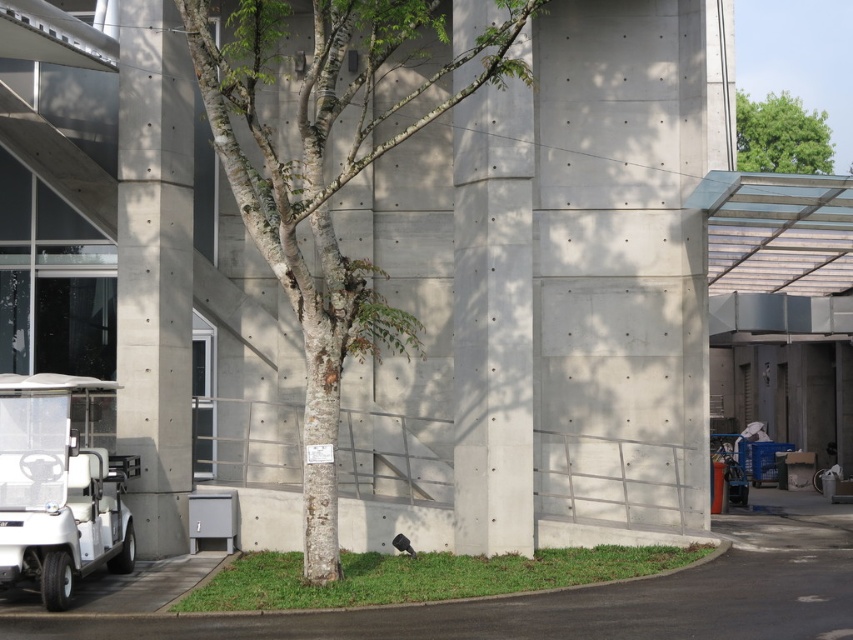
You are a city planner assessing the urban space in front of the building. You need to install a new streetlight that must be at least 2 meters taller than the tallest object in the area to ensure proper lighting. Based on the scene, which object between the concrete at center and the green leafy tree at upper right is the tallest, and will the streetlight meet the requirement if it is placed at 3 meters height?

The concrete at center is taller than the green leafy tree at upper right. Since the streetlight is to be placed at 3 meters height, it must be at least 2 meters taller than the tallest object. If the concrete at center is taller, then the streetlight needs to be at least 2 meters taller than the concrete. However, without knowing the exact height of the concrete, we cannot confirm if 3 meters is sufficient. The question might be incomplete or missing data.

You are a delivery person trying to park your white matte golf cart at lower left. The parking space requires a minimum width of 1.5 meters. Can you determine if the concrete at left has enough space to accommodate your golf cart?

The concrete at left has a width larger than the white matte golf cart at lower left, so yes, the parking space on the concrete at left is wide enough to accommodate the golf cart.

Looking at this image, you are a photographer standing in front of the modern building. You notice two points marked on your camera screen at coordinates point (229,109) and point (173,68). Which point is nearer to your current position?

Point (229,109) is closer to the camera than point (173,68), so the point (229,109) is nearer to your current position.